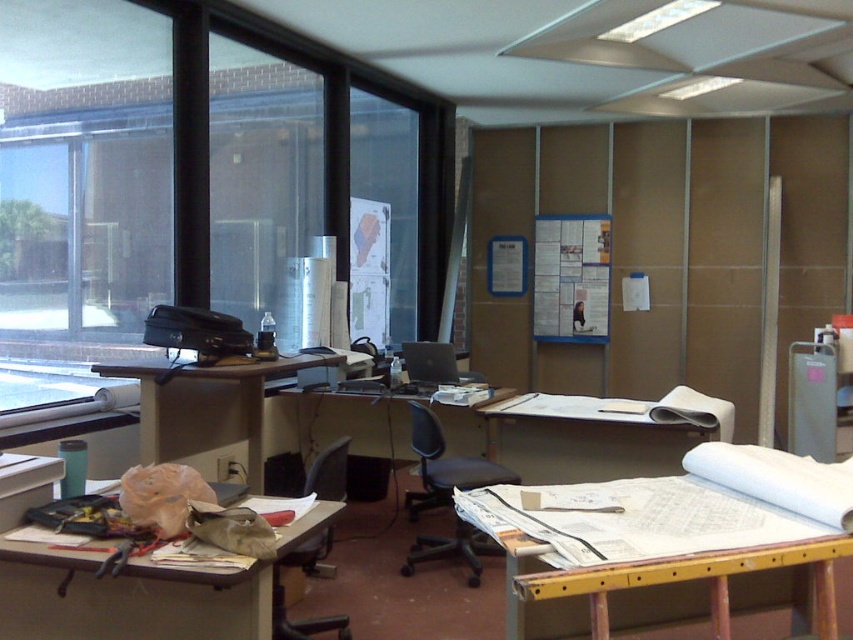
Which is in front, point (387, 116) or point (297, 406)?

Point (297, 406)

Does transparent glass window at upper left have a lesser width compared to matte plastic desk at center?

No.

Does point (270, 40) come in front of point (309, 426)?

Yes.

You are a GUI agent. You are given a task and a screenshot of the screen. Output one action in this format:
    pyautogui.click(x=<x>, y=<y>)
    Task: Click on the transparent glass window at upper left
    This screenshot has width=853, height=640.
    Given the screenshot: What is the action you would take?
    pyautogui.click(x=187, y=186)

Who is more forward, (79, 72) or (518, 458)?

Positioned in front is point (79, 72).

This screenshot has height=640, width=853. In order to click on transparent glass window at upper left in this screenshot , I will do [x=187, y=186].

At what (x,y) coordinates should I click in order to perform the action: click on transparent glass window at upper left. Please return your answer as a coordinate pair (x, y). Looking at the image, I should click on (187, 186).

Identify the location of transparent glass window at upper left. (187, 186).

Does transparent glass window at upper left appear under wooden desk at lower left?

Actually, transparent glass window at upper left is above wooden desk at lower left.

In order to click on transparent glass window at upper left in this screenshot , I will do `click(187, 186)`.